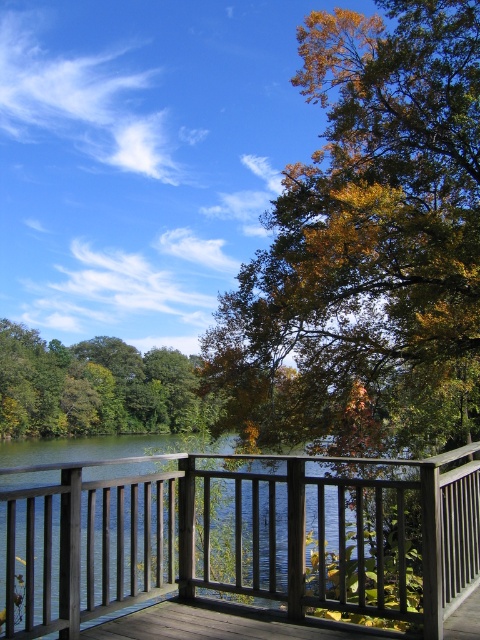
What do you see at coordinates (368, 248) in the screenshot?
I see `golden yellow leaves at center` at bounding box center [368, 248].

Is golden yellow leaves at center positioned behind green leafy tree at lower left?

No, it is in front of green leafy tree at lower left.

Describe the element at coordinates (368, 248) in the screenshot. I see `golden yellow leaves at center` at that location.

Locate an element on the screen. Image resolution: width=480 pixels, height=640 pixels. golden yellow leaves at center is located at coordinates (368, 248).

Which of these two, golden yellow leaves at center or wooden porch at center, stands taller?

With more height is golden yellow leaves at center.

Where is `golden yellow leaves at center`? Image resolution: width=480 pixels, height=640 pixels. golden yellow leaves at center is located at coordinates (368, 248).

Between point (316, 52) and point (406, 468), which one is positioned in front?

Point (406, 468) is in front.

Find the location of `golden yellow leaves at center`. golden yellow leaves at center is located at coordinates tap(368, 248).

Who is lower down, wooden porch at center or green leafy tree at lower left?

green leafy tree at lower left

Is wooden porch at center positioned before green leafy tree at lower left?

That is True.

Does point (417, 524) come closer to viewer compared to point (17, 428)?

Yes, it is in front of point (17, 428).

The width and height of the screenshot is (480, 640). Identify the location of wooden porch at center. (243, 534).